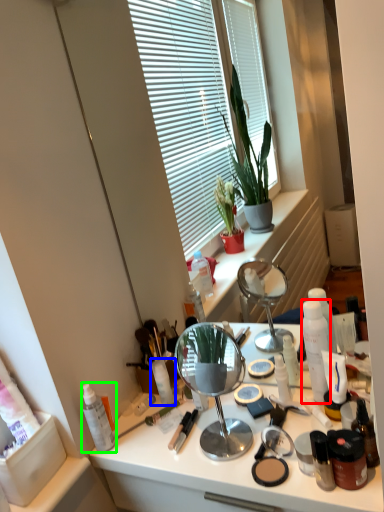
Question: Estimate the real-world distances between objects in this image. Which object is closer to toiletry (highlighted by a red box), toiletry (highlighted by a blue box) or toiletry (highlighted by a green box)?

Choices:
 (A) toiletry
 (B) toiletry

Answer: (A)